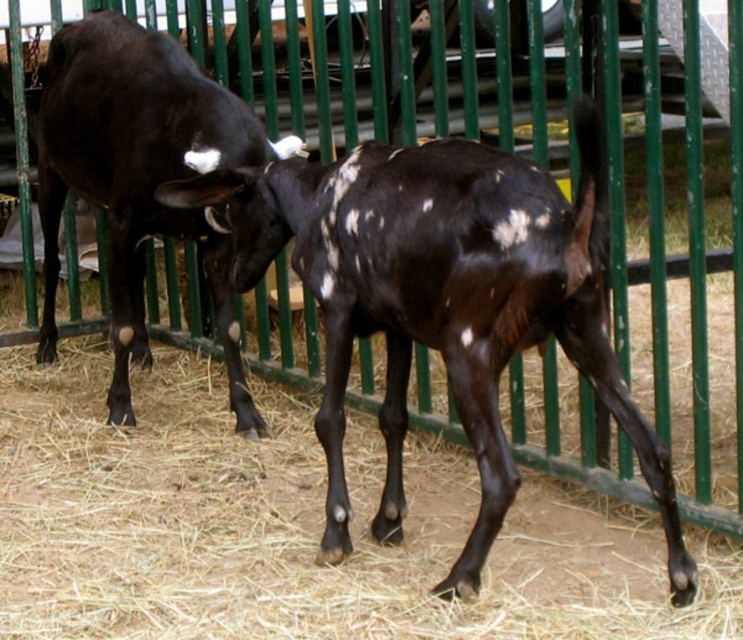
Is speckled glossy goat at center taller than black glossy bull at left?

No, speckled glossy goat at center is not taller than black glossy bull at left.

Can you confirm if speckled glossy goat at center is thinner than black glossy bull at left?

No, speckled glossy goat at center is not thinner than black glossy bull at left.

This screenshot has height=640, width=743. Find the location of `speckled glossy goat at center`. speckled glossy goat at center is located at coordinates (441, 300).

The width and height of the screenshot is (743, 640). Identify the location of speckled glossy goat at center. (441, 300).

Based on the photo, is brown straw at center further to camera compared to black glossy bull at left?

No, brown straw at center is in front of black glossy bull at left.

Looking at this image, who is shorter, brown straw at center or black glossy bull at left?

Standing shorter between the two is brown straw at center.

Which is in front, point (120, 595) or point (175, 129)?

Point (120, 595) is more forward.

Identify the location of brown straw at center. The height and width of the screenshot is (640, 743). (295, 525).

Identify the location of brown straw at center. click(295, 525).

Is brown straw at center to the left of speckled glossy goat at center from the viewer's perspective?

Indeed, brown straw at center is positioned on the left side of speckled glossy goat at center.

Measure the distance between brown straw at center and camera.

They are 10.27 feet apart.

Locate an element on the screen. This screenshot has height=640, width=743. brown straw at center is located at coordinates (295, 525).